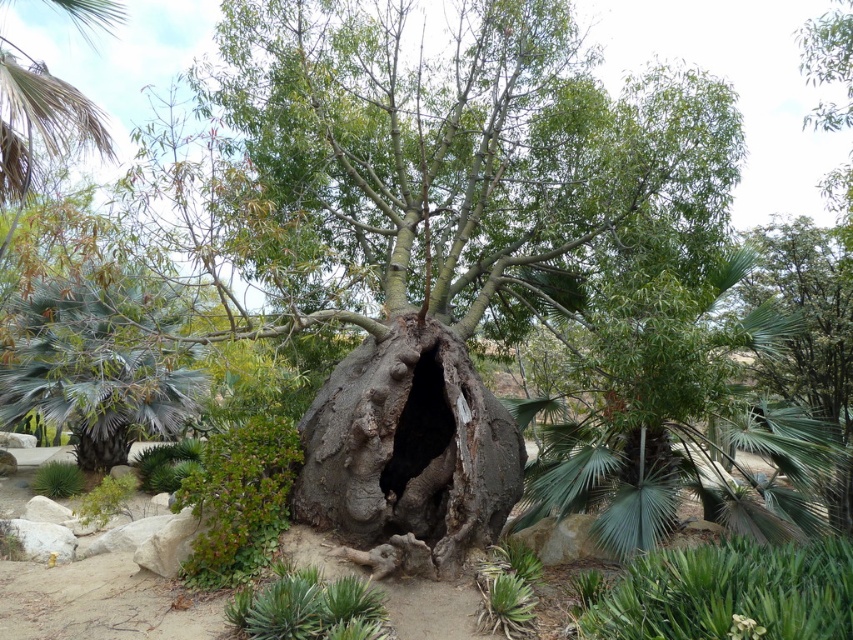
Question: Does green leafy palm at upper center have a larger size compared to rough bark tree trunk at center?

Choices:
 (A) yes
 (B) no

Answer: (A)

Question: Which point is farther to the camera?

Choices:
 (A) (57, 352)
 (B) (431, 518)

Answer: (A)

Question: Which object is closer to the camera taking this photo?

Choices:
 (A) rough bark tree trunk at center
 (B) green leafy palm at upper center
 (C) dark rough bark hole at center

Answer: (A)

Question: Is rough bark tree trunk at center to the left of green succulent at lower right from the viewer's perspective?

Choices:
 (A) yes
 (B) no

Answer: (A)

Question: Can you confirm if green leafy palm at upper center is positioned above rough bark tree trunk at center?

Choices:
 (A) no
 (B) yes

Answer: (B)

Question: Which point appears closest to the camera in this image?

Choices:
 (A) (657, 516)
 (B) (103, 420)
 (C) (401, 492)

Answer: (A)